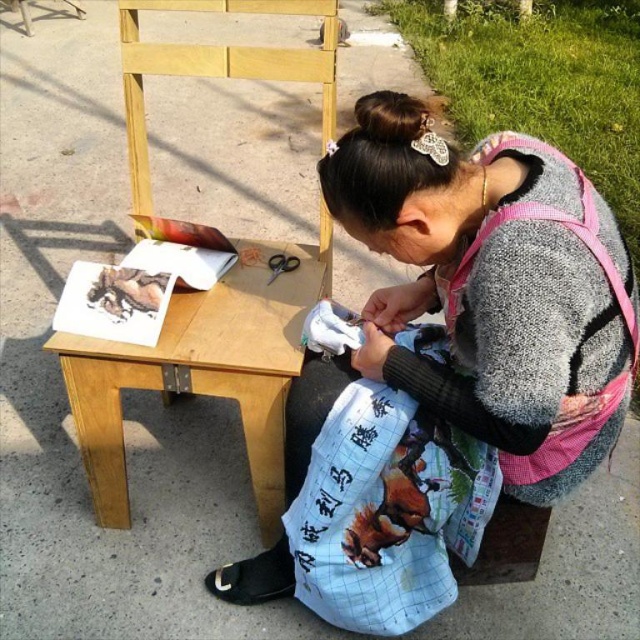
You are organizing a craft fair booth and need to place the printed fabric tote bag at lower center and the wooden table at center. Which object is shorter?

The printed fabric tote bag at lower center is shorter than the wooden table at center.

You are taking a photo of the cross stitch project and need to focus on either the point at point (476, 177) or the point at point (109, 449). Which point should you focus on to ensure it appears clearer in the photo?

You should focus on point (476, 177) because it is closer to the camera and will appear clearer in the photo.